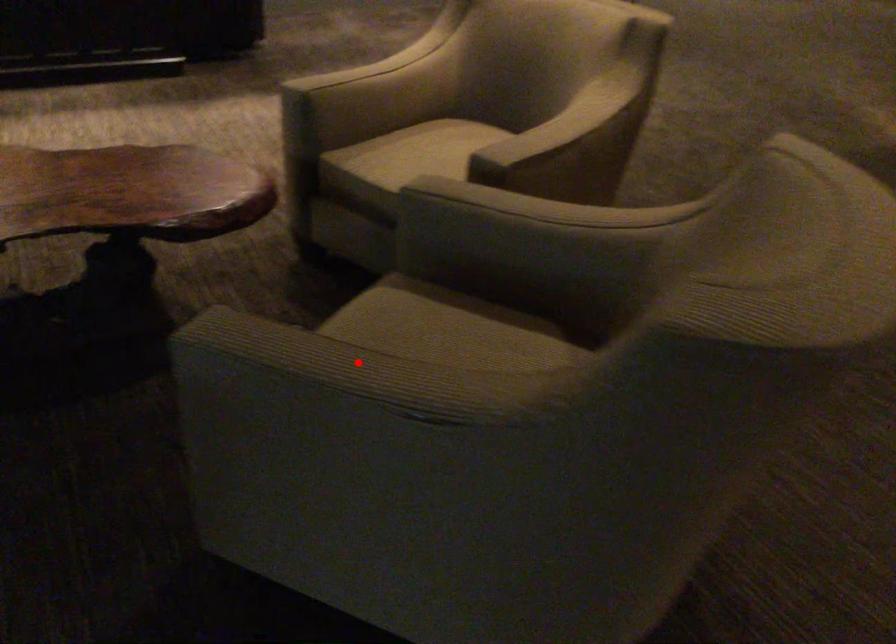
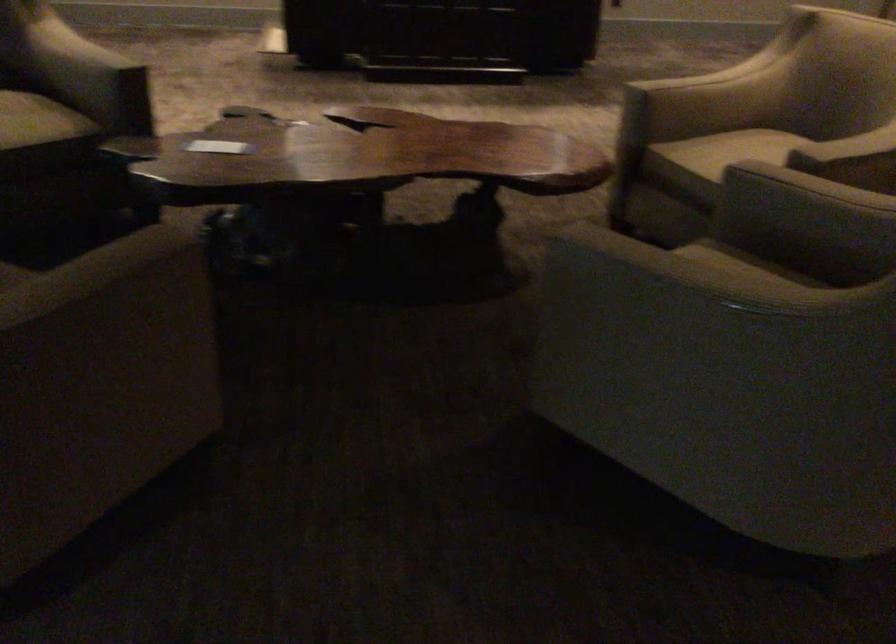
The point at the highlighted location is marked in the first image. Where is the corresponding point in the second image?

(690, 268)